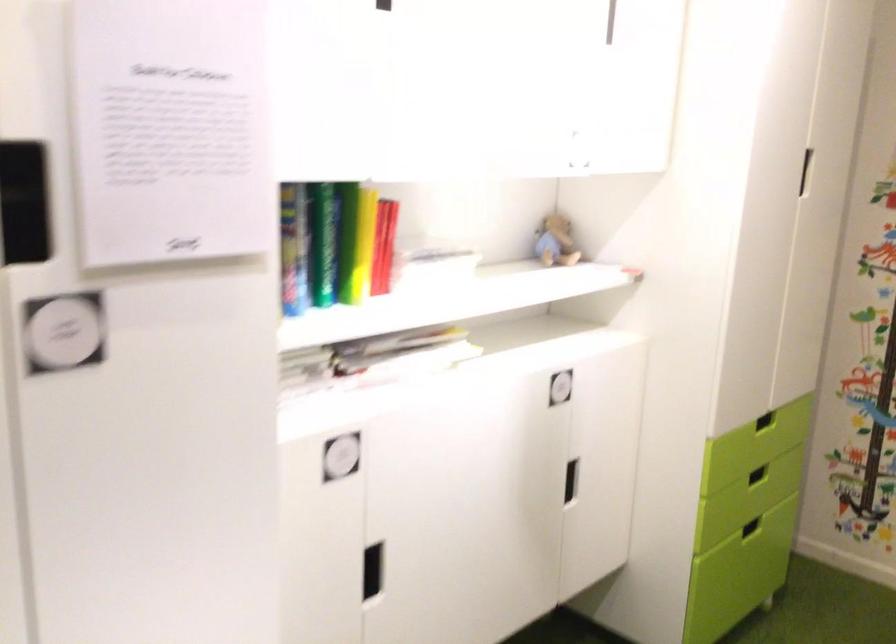
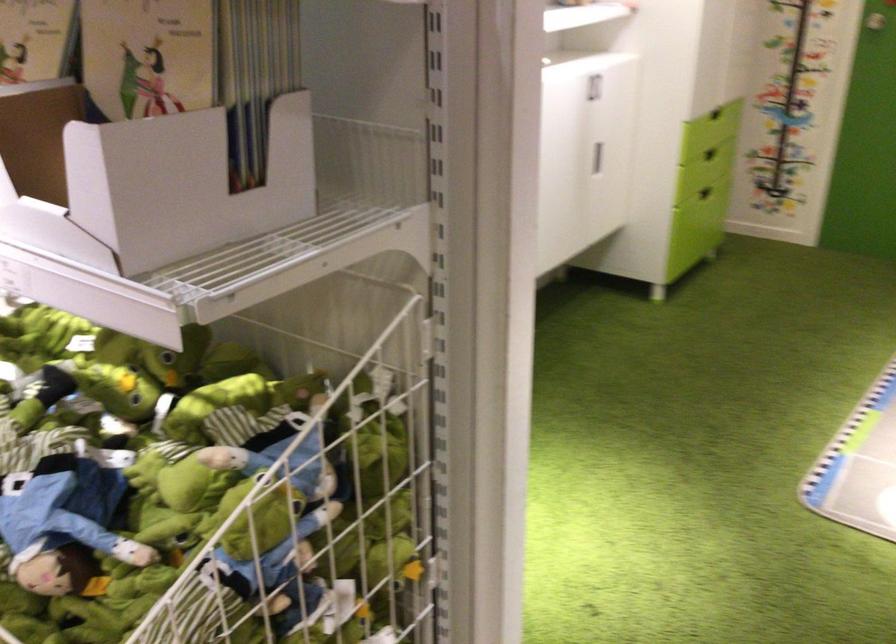
The point at [739,529] is marked in the first image. Where is the corresponding point in the second image?

(704, 193)